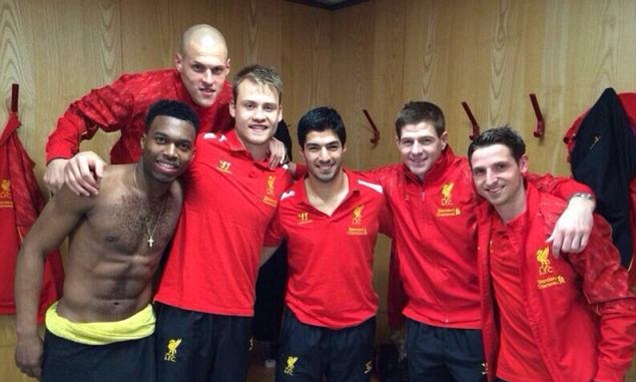
The height and width of the screenshot is (382, 636). I want to click on red clothing hooks, so click(540, 130), click(473, 124), click(371, 127), click(7, 95).